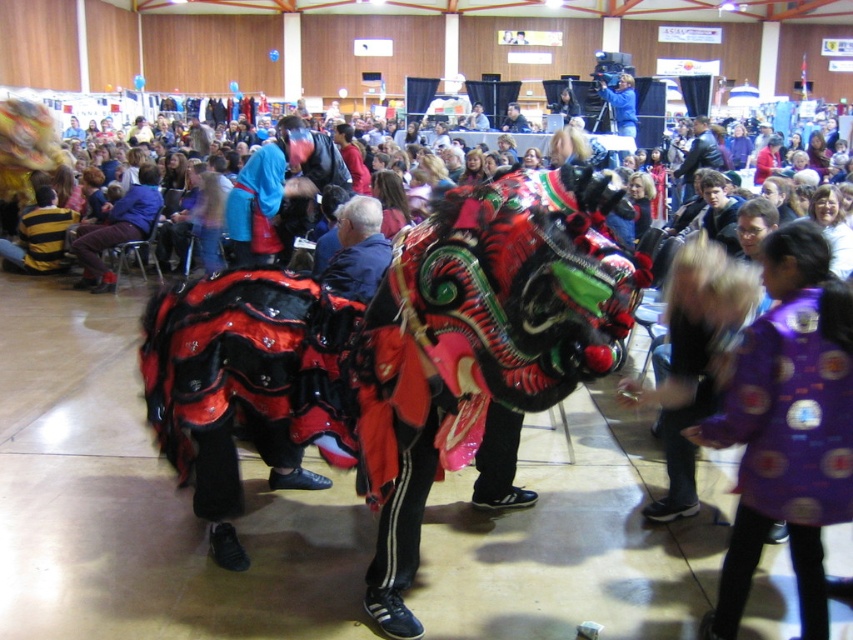
Question: Can you confirm if leather jacket at center is positioned below matte blue jacket at center?

Choices:
 (A) no
 (B) yes

Answer: (B)

Question: Which point appears closest to the camera in this image?

Choices:
 (A) (509, 108)
 (B) (698, 147)
 (C) (724, 424)

Answer: (C)

Question: Which point is closer to the camera taking this photo?

Choices:
 (A) (689, 173)
 (B) (834, 483)

Answer: (B)

Question: Does purple fabric costume at lower right have a larger size compared to matte blue jacket at center?

Choices:
 (A) yes
 (B) no

Answer: (B)

Question: Based on their relative distances, which object is farther from the leather jacket at center?

Choices:
 (A) purple fabric costume at lower right
 (B) matte blue jacket at center

Answer: (A)

Question: Is leather jacket at center to the right of matte blue jacket at center from the viewer's perspective?

Choices:
 (A) no
 (B) yes

Answer: (B)